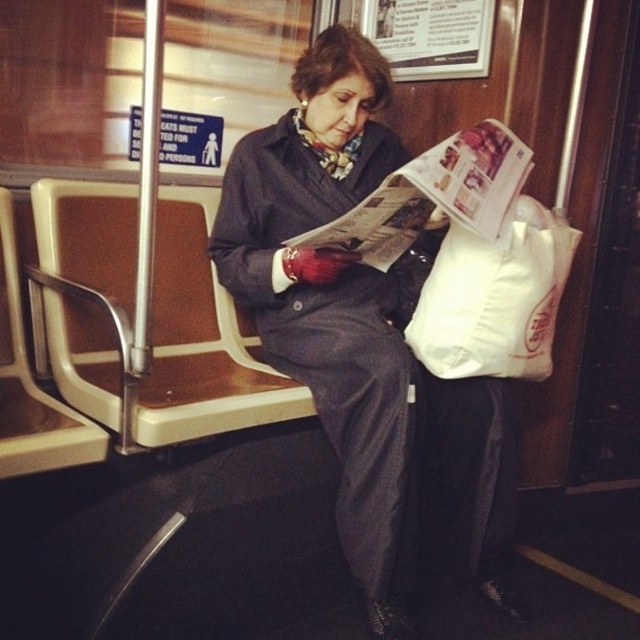
Is matte black coat at center bigger than white paper bag at right?

Indeed, matte black coat at center has a larger size compared to white paper bag at right.

The height and width of the screenshot is (640, 640). Describe the element at coordinates (336, 301) in the screenshot. I see `matte black coat at center` at that location.

The image size is (640, 640). Find the location of `matte black coat at center`. matte black coat at center is located at coordinates (336, 301).